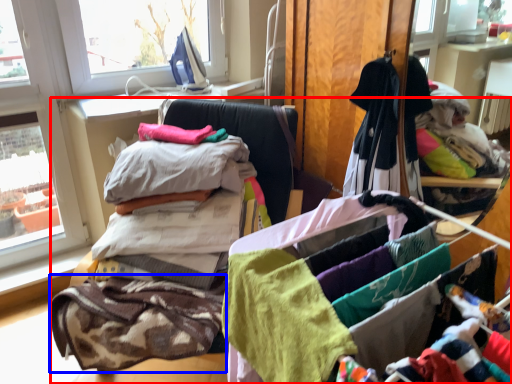
Question: Among these objects, which one is nearest to the camera, furniture (highlighted by a red box) or baby clothe (highlighted by a blue box)?

Choices:
 (A) furniture
 (B) baby clothe

Answer: (A)